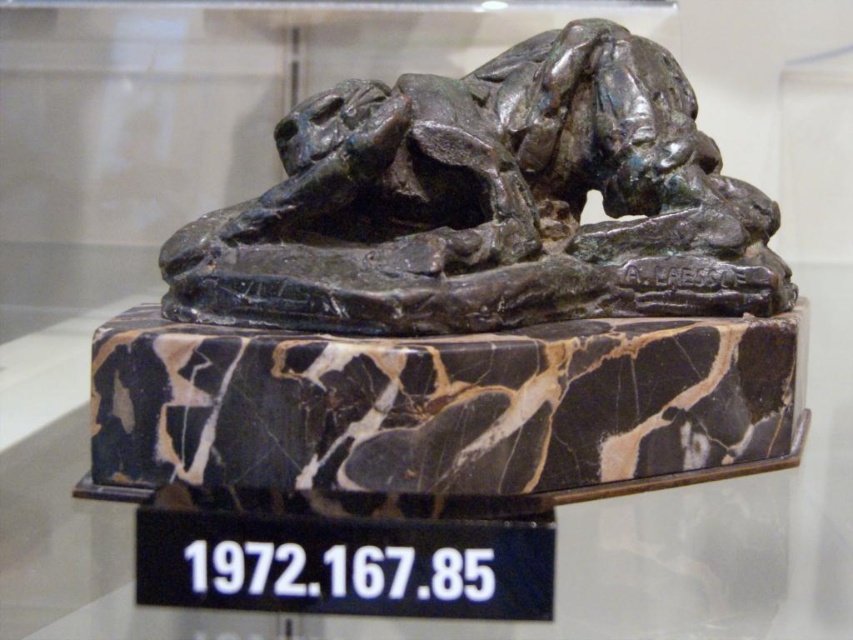
Question: Which point appears farthest from the camera in this image?

Choices:
 (A) tap(640, 340)
 (B) tap(735, 195)

Answer: (B)

Question: In this image, where is bronze sculpture at center located relative to marble at center?

Choices:
 (A) above
 (B) below

Answer: (A)

Question: Among these objects, which one is nearest to the camera?

Choices:
 (A) bronze sculpture at center
 (B) marble at center

Answer: (A)

Question: From the image, what is the correct spatial relationship of bronze sculpture at center in relation to marble at center?

Choices:
 (A) left
 (B) right

Answer: (A)

Question: Is bronze sculpture at center wider than marble at center?

Choices:
 (A) no
 (B) yes

Answer: (A)